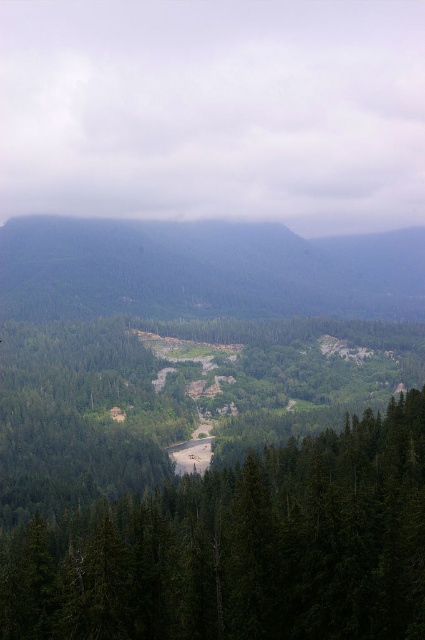
You are a hiker trying to navigate through the forest. You see the green matte tree at center and the green forested hillside at center. Which one is closer to you?

The green matte tree at center is closer because it is smaller than the green forested hillside at center, indicating it is in the foreground.